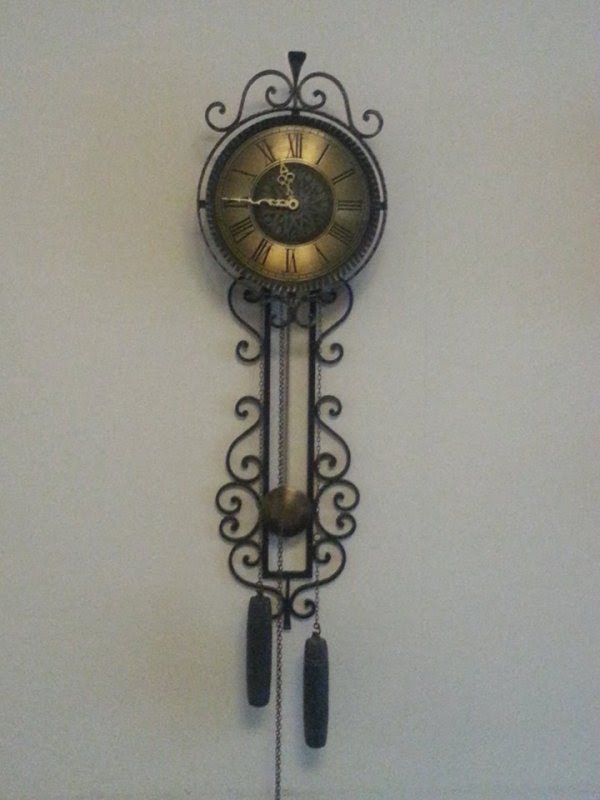
You are a GUI agent. You are given a task and a screenshot of the screen. Output one action in this format:
    pyautogui.click(x=<x>, y=<y>)
    Task: Click on the decorative metal
    
    Given the screenshot: What is the action you would take?
    pos(323,426), pos(253,533), pos(343,533), pos(231,453)